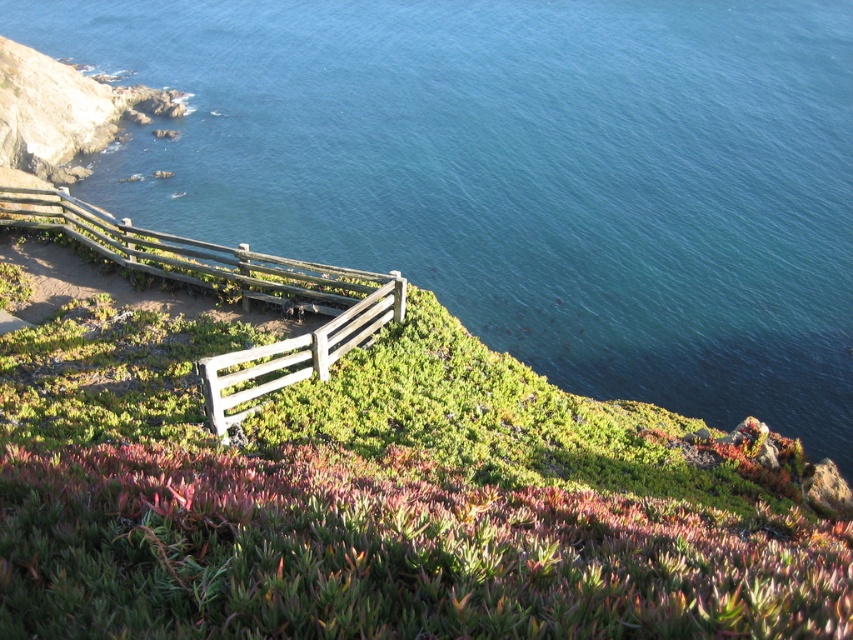
Who is higher up, blue water at upper center or green succulent at lower center?

Positioned higher is blue water at upper center.

Can you confirm if blue water at upper center is taller than green succulent at lower center?

Correct, blue water at upper center is much taller as green succulent at lower center.

Describe the element at coordinates (524, 173) in the screenshot. I see `blue water at upper center` at that location.

You are a GUI agent. You are given a task and a screenshot of the screen. Output one action in this format:
    pyautogui.click(x=<x>, y=<y>)
    Task: Click on the blue water at upper center
    The height and width of the screenshot is (640, 853).
    Given the screenshot: What is the action you would take?
    pyautogui.click(x=524, y=173)

Is point (830, 582) positioned after point (364, 316)?

That is False.

The width and height of the screenshot is (853, 640). What do you see at coordinates (387, 554) in the screenshot?
I see `green succulent at lower center` at bounding box center [387, 554].

Identify the location of green succulent at lower center. This screenshot has height=640, width=853. (387, 554).

Is point (396, 220) positioned after point (316, 332)?

That is True.

Which of these two, blue water at upper center or wooden fence at center, stands shorter?

wooden fence at center is shorter.

The height and width of the screenshot is (640, 853). Identify the location of blue water at upper center. (524, 173).